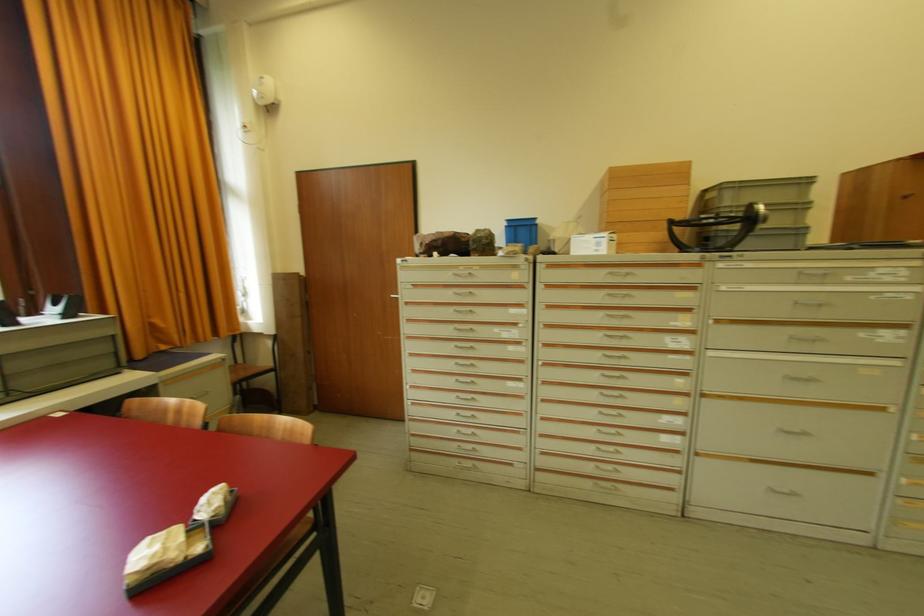
The height and width of the screenshot is (616, 924). In order to click on white cardboard box in this screenshot , I will do `click(592, 244)`.